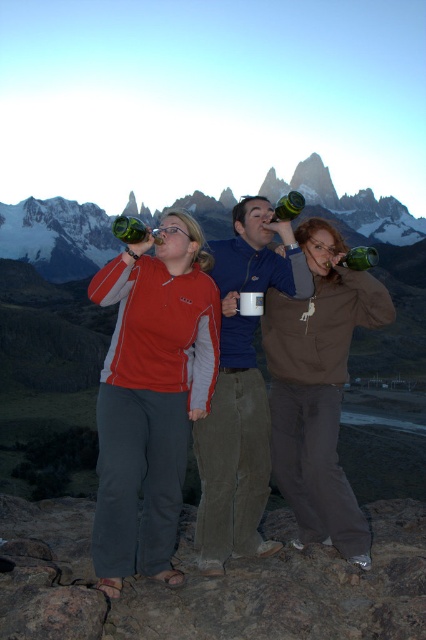
You are a photographer wanting to capture a group photo of the green glass bottle at center and the green matte bottle at center. Given that your camera has a maximum focus range of 30 meters, will you be able to focus on both bottles simultaneously?

The distance between the green glass bottle at center and the green matte bottle at center is 33.47 meters, which exceeds the camera maximum focus range of 30 meters. Therefore, you cannot focus on both bottles simultaneously.